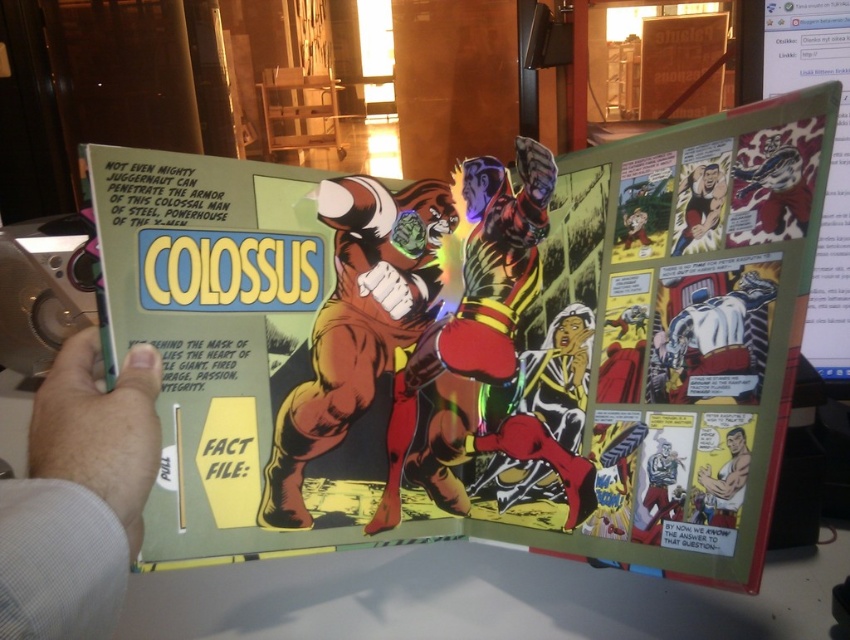
Question: Is matte plastic comic book at center bigger than smooth black hair at upper right?

Choices:
 (A) yes
 (B) no

Answer: (A)

Question: Is the position of smooth black hair at upper right more distant than that of smooth skin figure at upper right?

Choices:
 (A) no
 (B) yes

Answer: (A)

Question: Which object is positioned closest to the smooth black hair at upper right?

Choices:
 (A) shiny metallic armor at center
 (B) brown muscular figure at center

Answer: (A)

Question: Among these objects, which one is nearest to the camera?

Choices:
 (A) brown muscular figure at center
 (B) blue fabric shirt at lower right
 (C) smooth skin man at lower right

Answer: (C)

Question: Which object is closer to the camera taking this photo?

Choices:
 (A) smooth black hair at upper right
 (B) brown muscular figure at center
 (C) smooth skin figure at upper right

Answer: (A)

Question: Does smooth black hair at upper right have a lesser width compared to smooth skin figure at upper right?

Choices:
 (A) no
 (B) yes

Answer: (B)